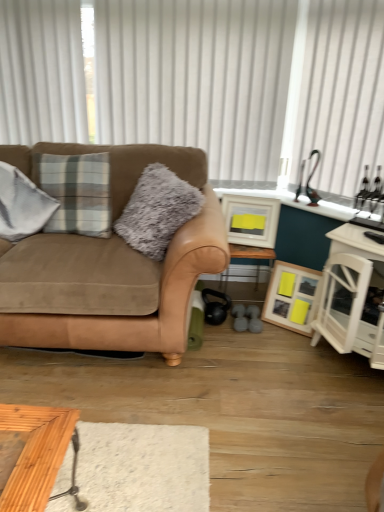
At what (x,y) coordinates should I click in order to perform the action: click on free space that is to the left of wooden picture frame at lower right, which is counted as the 1th picture frame, starting from the bottom. Please return your answer as a coordinate pair (x, y). The height and width of the screenshot is (512, 384). Looking at the image, I should click on (270, 331).